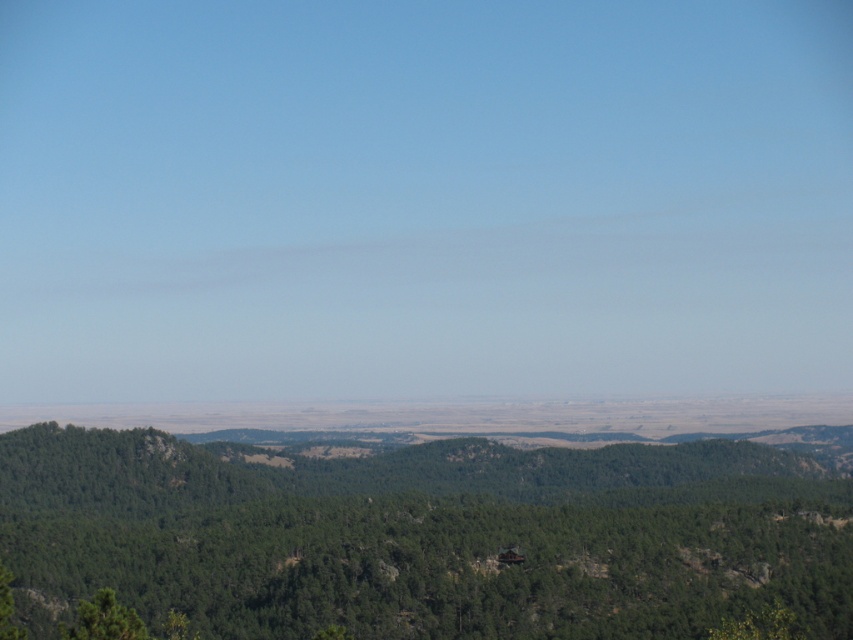
You are a hiker who wants to take a photo of the green leafy tree at center and the green matte tree at lower left. Which tree should you stand closer to in order to capture both in a single frame?

You should stand closer to the green matte tree at lower left because the green leafy tree at center is taller than the green matte tree at lower left, so by positioning yourself nearer to the shorter tree, both trees can be included within the camera frame more easily.

You are standing at the origin point in the landscape and want to reach the green leafy tree at center. According to the coordinates provided, in which direction should you move to get closer to the tree?

The green leafy tree at center is located at point (426, 536). Since you are at the origin, you should move in the positive x and y directions to reach it.

You are an environmental scientist assessing the forest health. You observe the green leafy tree at center and the green matte tree at lower left. Which tree has a wider canopy spread?

The green leafy tree at center has a larger width than the green matte tree at lower left, indicating it has a wider canopy spread.